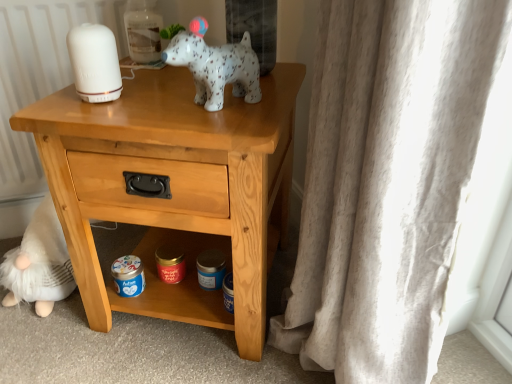
You are a GUI agent. You are given a task and a screenshot of the screen. Output one action in this format:
    pyautogui.click(x=<x>, y=<y>)
    Task: Click on the vacant area that is situated to the right of white speckled ceramic dog at upper center
    This screenshot has height=384, width=512.
    Given the screenshot: What is the action you would take?
    pyautogui.click(x=265, y=101)